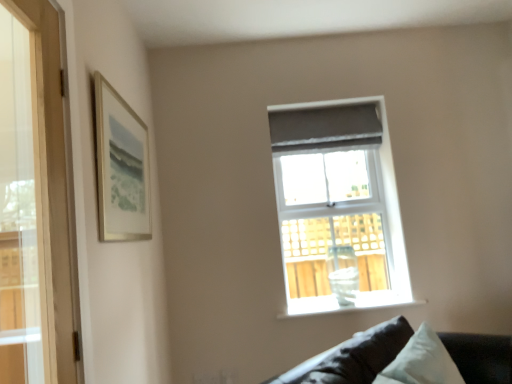
Question: From a real-world perspective, is matte silver picture frame at upper left physically located above or below matte gray window at upper center?

Choices:
 (A) above
 (B) below

Answer: (A)

Question: Is matte silver picture frame at upper left taller or shorter than matte gray window at upper center?

Choices:
 (A) short
 (B) tall

Answer: (A)

Question: Estimate the real-world distances between objects in this image. Which object is closer to the matte gray curtain at upper center?

Choices:
 (A) matte silver picture frame at upper left
 (B) dark gray fabric couch at lower right
 (C) matte gray window at upper center
 (D) white glossy vase at center

Answer: (C)

Question: Which object is the farthest from the matte silver picture frame at upper left?

Choices:
 (A) matte gray window at upper center
 (B) white glossy vase at center
 (C) dark gray fabric couch at lower right
 (D) matte gray curtain at upper center

Answer: (B)